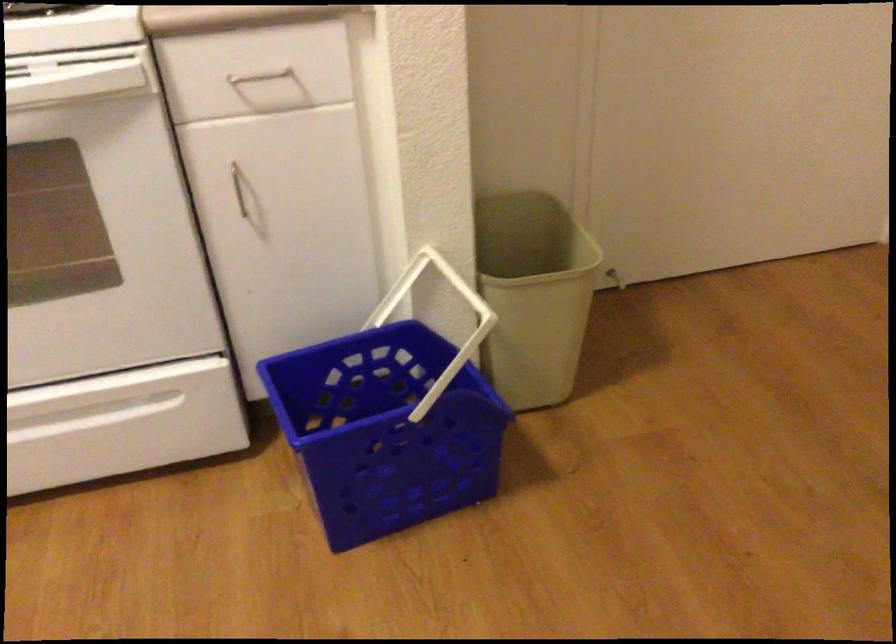
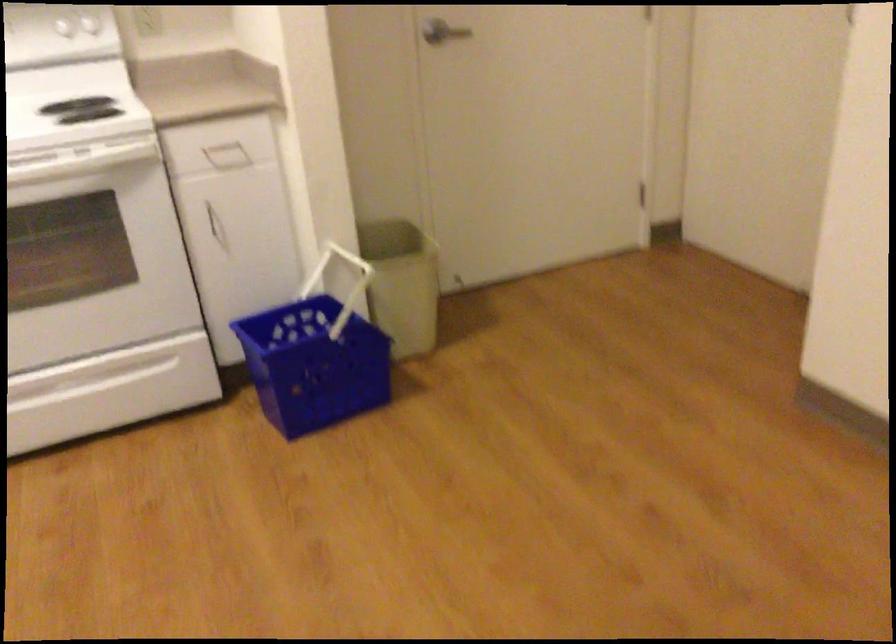
Where in the second image is the point corresponding to (x=251, y=205) from the first image?

(216, 225)